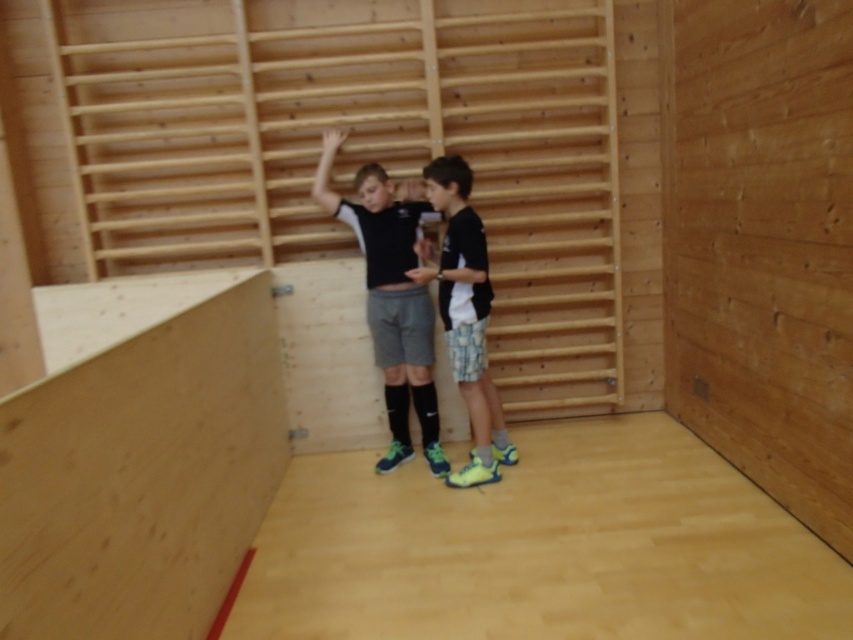
You are standing in the gymnasium and want to place a small potted plant at the point marked by the coordinates point (138, 456). Based on the scene description, where exactly would this potted plant be positioned relative to the light brown wood ramp at lower left?

The point (138, 456) corresponds to the location of the light brown wood ramp at lower left, so placing the potted plant there would position it directly on the ramp.

From the picture: You are a person who wants to climb the wooden wall. You see the light brown wood ramp at lower left and the black matte shorts at center. Which object can you use to reach the wooden wall?

The light brown wood ramp at lower left can be used to reach the wooden wall because its width surpasses the black matte shorts at center, making it more stable and suitable for climbing.